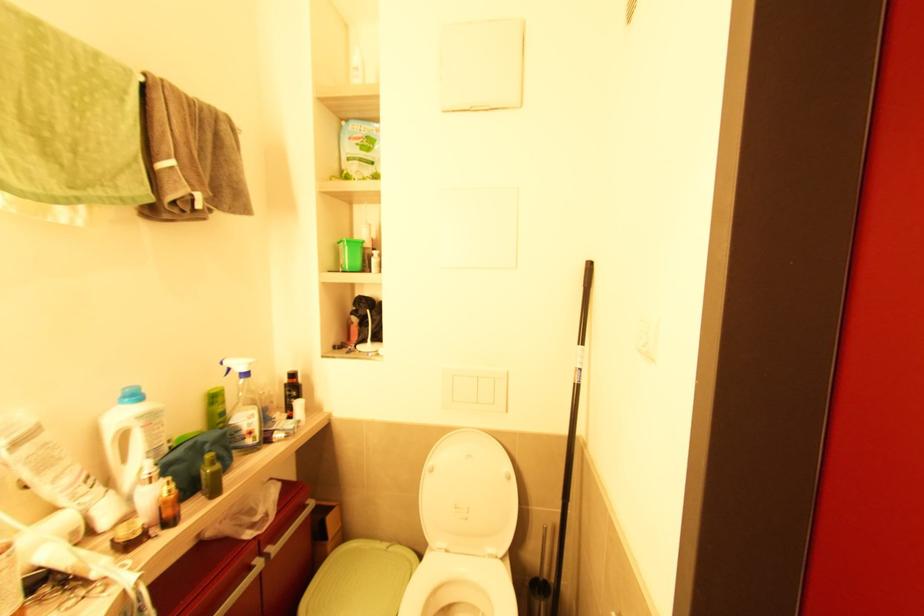
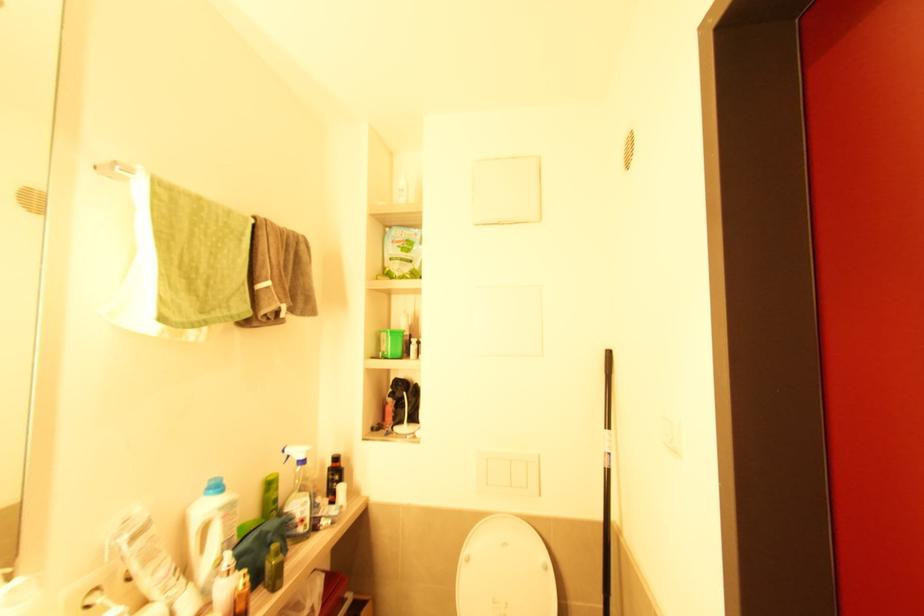
In the second image, find the point that corresponds to pixel 144 428 in the first image.

(224, 519)